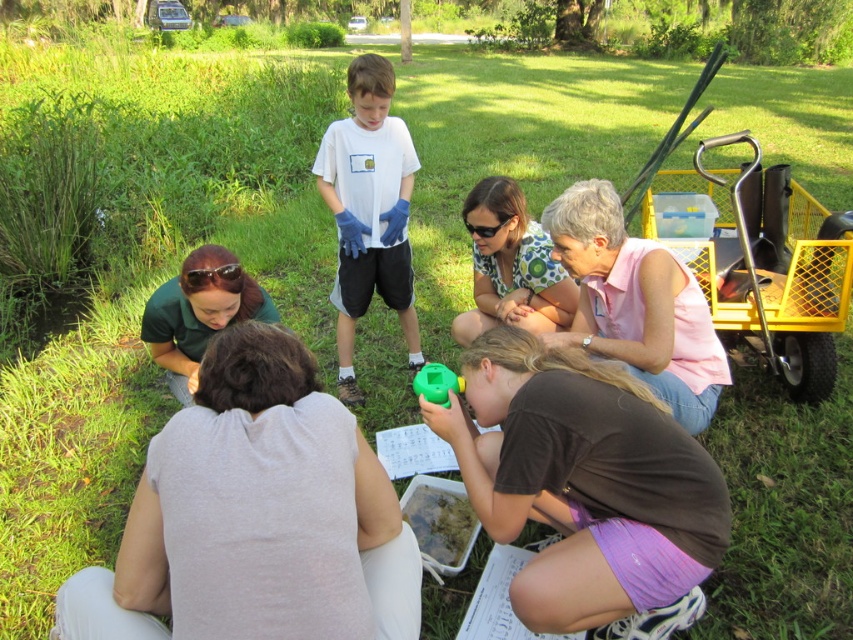
In the scene shown: You are a photographer trying to capture a clear shot of the white fabric at lower center and the green matte shirt at lower left. Which object will appear larger in your photo?

The white fabric at lower center will appear larger in the photo because it is closer to the viewer than the green matte shirt at lower left.